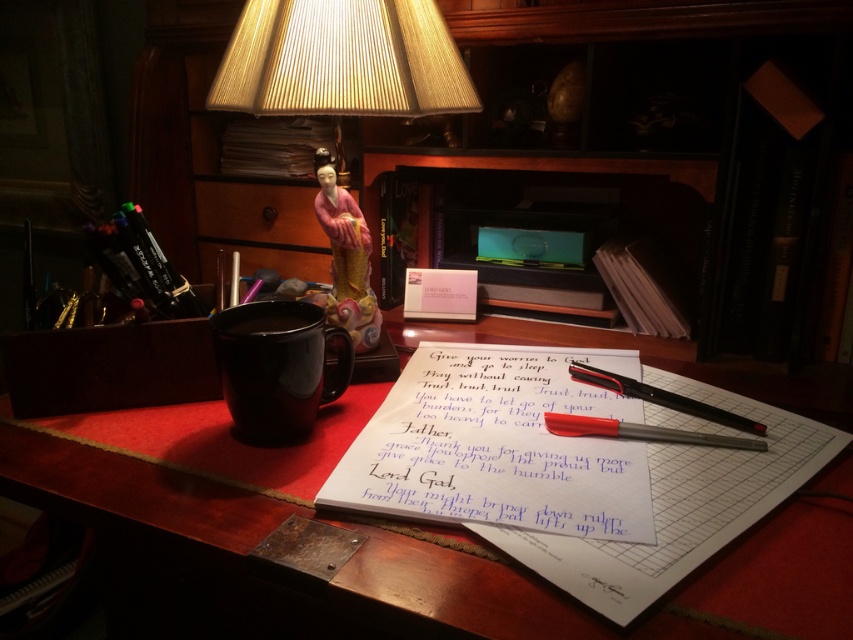
Looking at this image, what is located at the point marked by the coordinates [498,445] in the image?

The point marked by the coordinates [498,445] is where the white paper notebook at center is located.

Looking at this image, you are organizing your desk and need to place both the white paper notebook at center and the matte black mug at center. If you want to arrange them side by side without overlapping, which object should you place first to ensure there is enough space?

The white paper notebook at center should be placed first since its width is larger than the matte black mug at center, allowing enough space for both when arranged side by side.

You are organizing items on your desk and need to place a new item exactly at the coordinates where the matte red pencil at center is located. What are the coordinates where you should place the new item?

The coordinates for the matte red pencil at center are at point (642, 432), so you should place the new item there.